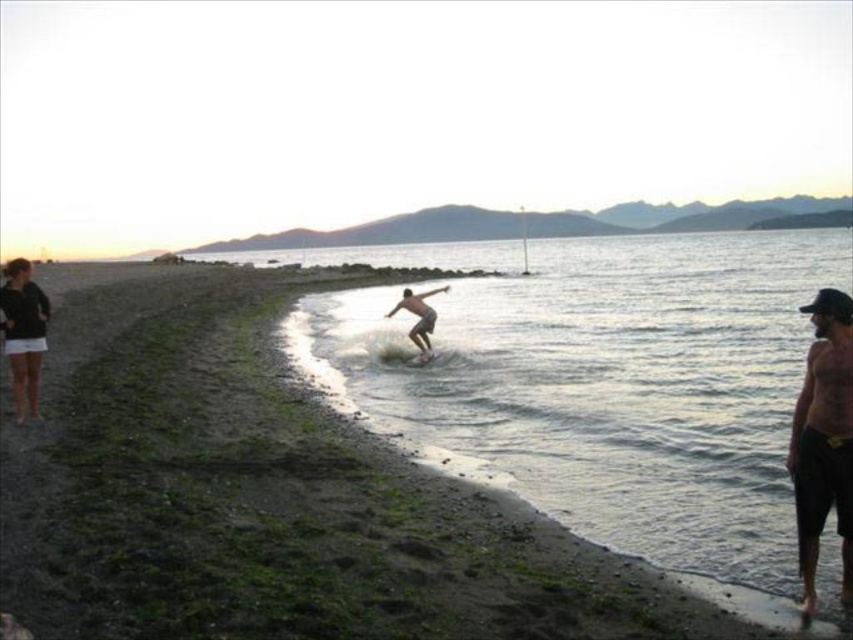
Does clear water at center come behind white foam surfboard at center?

No, clear water at center is closer to the viewer.

Between clear water at center and white foam surfboard at center, which one is positioned higher?

clear water at center

From the picture: Measure the distance between clear water at center and camera.

clear water at center and camera are 6.18 meters apart from each other.

The height and width of the screenshot is (640, 853). Identify the location of clear water at center. (608, 387).

Is clear water at center above smooth tan surfboard at center?

Indeed, clear water at center is positioned over smooth tan surfboard at center.

Based on the photo, is clear water at center smaller than smooth tan surfboard at center?

No, clear water at center is not smaller than smooth tan surfboard at center.

Who is more distant from viewer, (347, 346) or (412, 310)?

Positioned behind is point (347, 346).

In order to click on clear water at center in this screenshot , I will do `click(608, 387)`.

Looking at this image, does smooth tan surfboard at center have a greater height compared to white foam surfboard at center?

Indeed, smooth tan surfboard at center has a greater height compared to white foam surfboard at center.

How distant is smooth tan surfboard at center from white foam surfboard at center?

smooth tan surfboard at center is 33.76 inches from white foam surfboard at center.

Between point (434, 317) and point (405, 358), which one is positioned in front?

Point (434, 317) is more forward.

At what (x,y) coordinates should I click in order to perform the action: click on smooth tan surfboard at center. Please return your answer as a coordinate pair (x, y). Looking at the image, I should click on (418, 316).